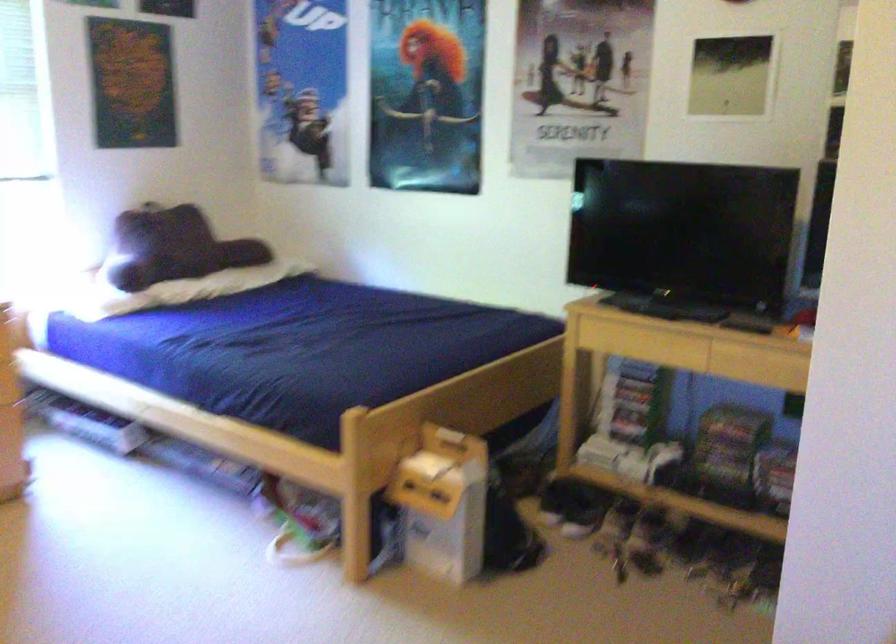
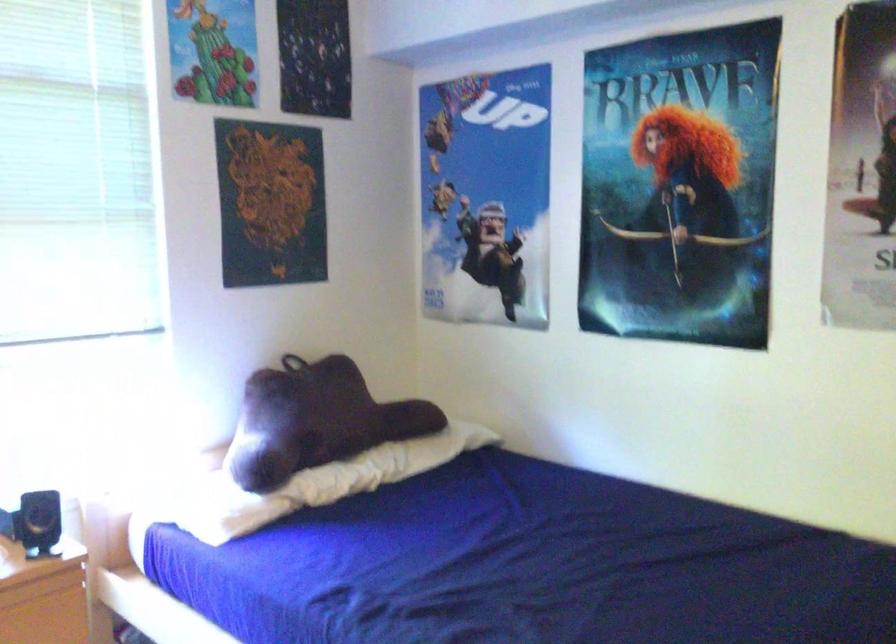
Locate, in the second image, the point that corresponds to the point at 168,287 in the first image.

(314, 484)